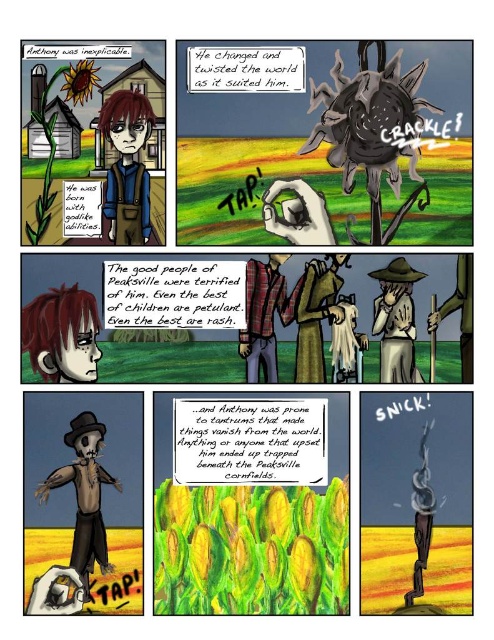
You are a farmer who wants to place a new scarecrow in your field. You have a wooden scarecrow at lower left and a brown straw hat at center. Which object is positioned lower in the field?

The wooden scarecrow at lower left is positioned lower than the brown straw hat at center in the field.

In the comic strip, you are standing at the position of point (468, 298). Can you see the point (116, 148) behind it?

Point (116, 148) is behind point (468, 298), so yes, you can see it behind.